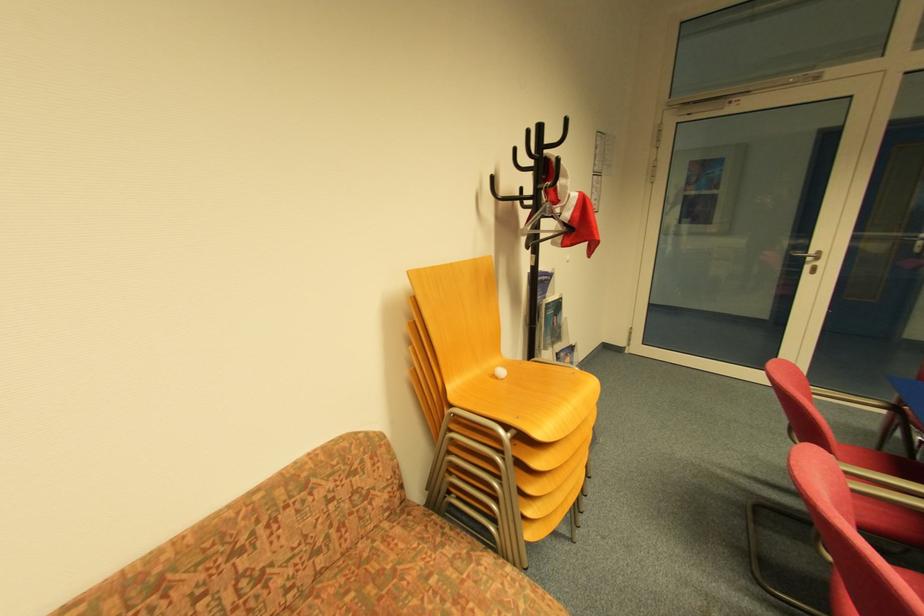
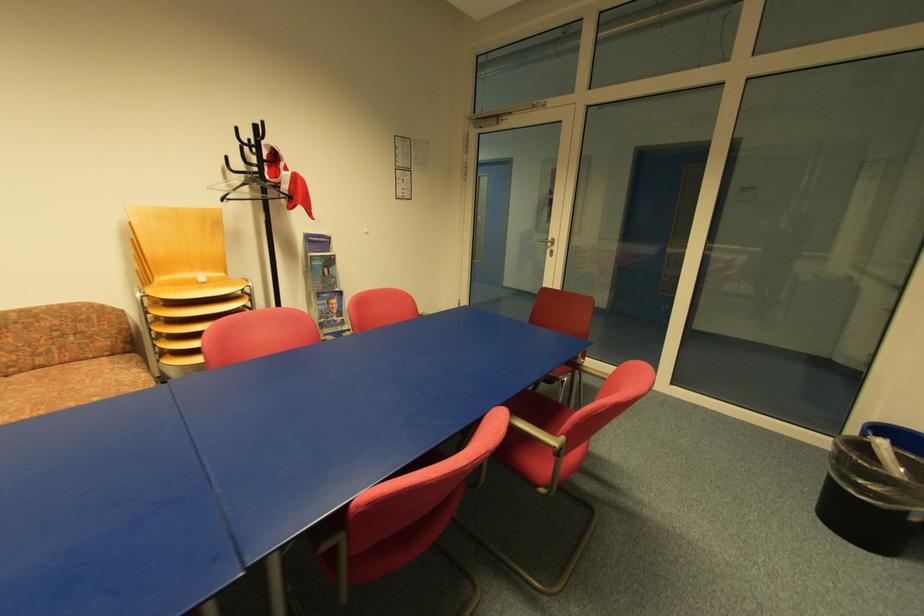
Locate, in the second image, the point that corresponds to (506,379) in the first image.

(207, 285)